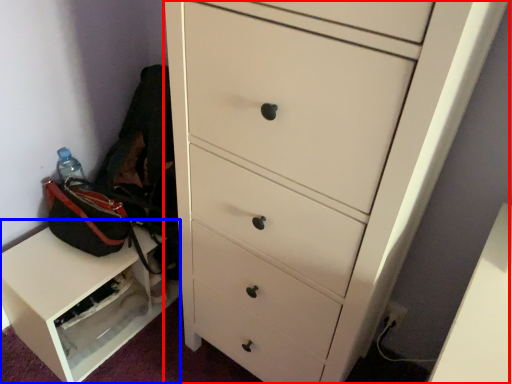
Question: Which of the following is the closest to the observer, chest of drawers (highlighted by a red box) or cabinetry (highlighted by a blue box)?

Choices:
 (A) chest of drawers
 (B) cabinetry

Answer: (A)